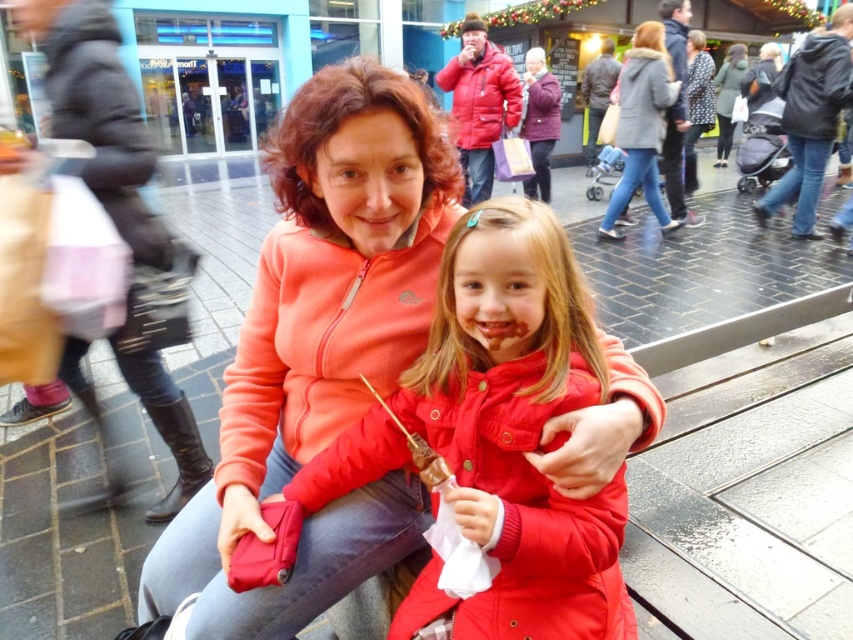
Locate an element on the screen. This screenshot has width=853, height=640. polka dot fabric coat at upper right is located at coordinates (695, 104).

Does polka dot fabric coat at upper right appear on the left side of dark gray woolen jacket at upper right?

Yes, polka dot fabric coat at upper right is to the left of dark gray woolen jacket at upper right.

Which is behind, point (688, 136) or point (717, 93)?

The point (717, 93) is more distant.

You are a GUI agent. You are given a task and a screenshot of the screen. Output one action in this format:
    pyautogui.click(x=<x>, y=<y>)
    Task: Click on the polka dot fabric coat at upper right
    
    Given the screenshot: What is the action you would take?
    pyautogui.click(x=695, y=104)

Is point (520, 92) closer to camera compared to point (701, 65)?

Yes, point (520, 92) is in front of point (701, 65).

Is matte red jacket at upper center behind polka dot fabric coat at upper right?

No.

Where is `matte red jacket at upper center`? matte red jacket at upper center is located at coordinates (480, 97).

Can you confirm if gray wool coat at upper center is positioned above matte red jacket at upper center?

No.

Can you confirm if gray wool coat at upper center is positioned to the right of matte red jacket at upper center?

Indeed, gray wool coat at upper center is positioned on the right side of matte red jacket at upper center.

Describe the element at coordinates (641, 125) in the screenshot. The height and width of the screenshot is (640, 853). I see `gray wool coat at upper center` at that location.

The width and height of the screenshot is (853, 640). I want to click on gray wool coat at upper center, so click(x=641, y=125).